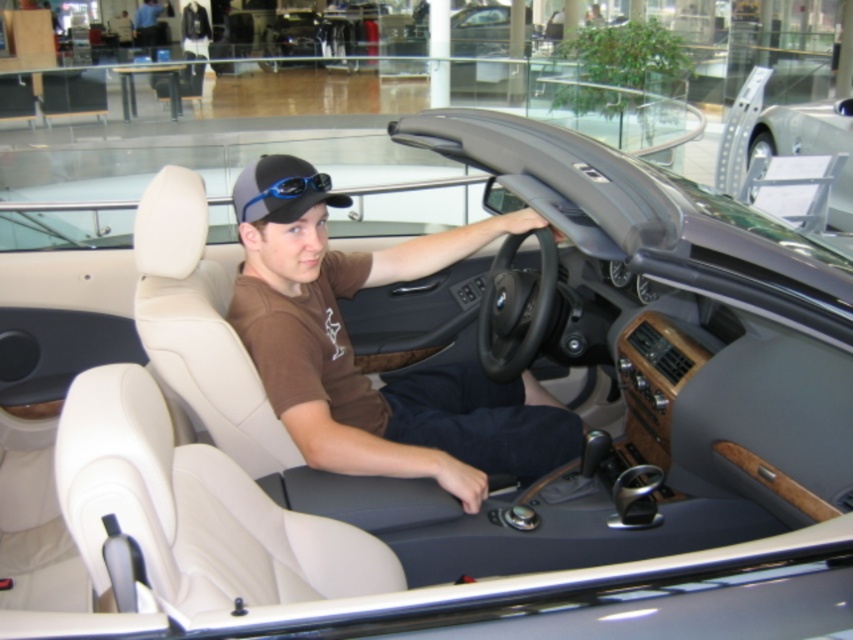
Question: Which object appears farthest from the camera in this image?

Choices:
 (A) brown cotton t-shirt at center
 (B) black fabric baseball cap at center
 (C) silver metallic car at upper right

Answer: (C)

Question: Can you confirm if black fabric baseball cap at center is smaller than silver metallic car at upper right?

Choices:
 (A) no
 (B) yes

Answer: (B)

Question: Is brown cotton t-shirt at center further to the viewer compared to silver metallic car at upper right?

Choices:
 (A) yes
 (B) no

Answer: (B)

Question: Considering the real-world distances, which object is farthest from the black fabric baseball cap at center?

Choices:
 (A) brown cotton t-shirt at center
 (B) silver metallic car at upper right

Answer: (B)

Question: Can you confirm if brown cotton t-shirt at center is thinner than silver metallic car at upper right?

Choices:
 (A) no
 (B) yes

Answer: (A)

Question: Which point appears closest to the camera in this image?

Choices:
 (A) (733, 180)
 (B) (314, 326)
 (C) (259, 161)

Answer: (C)